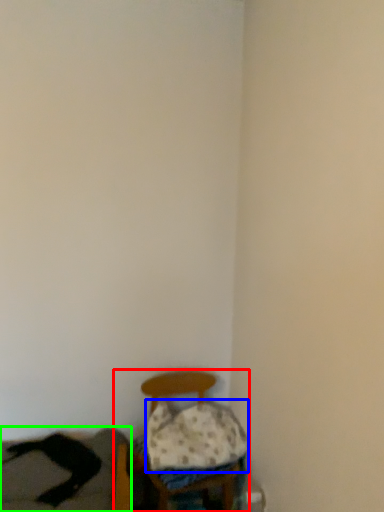
Question: Which object is positioned closest to furniture (highlighted by a red box)? Select from pillow (highlighted by a blue box) and couch (highlighted by a green box).

Choices:
 (A) pillow
 (B) couch

Answer: (A)